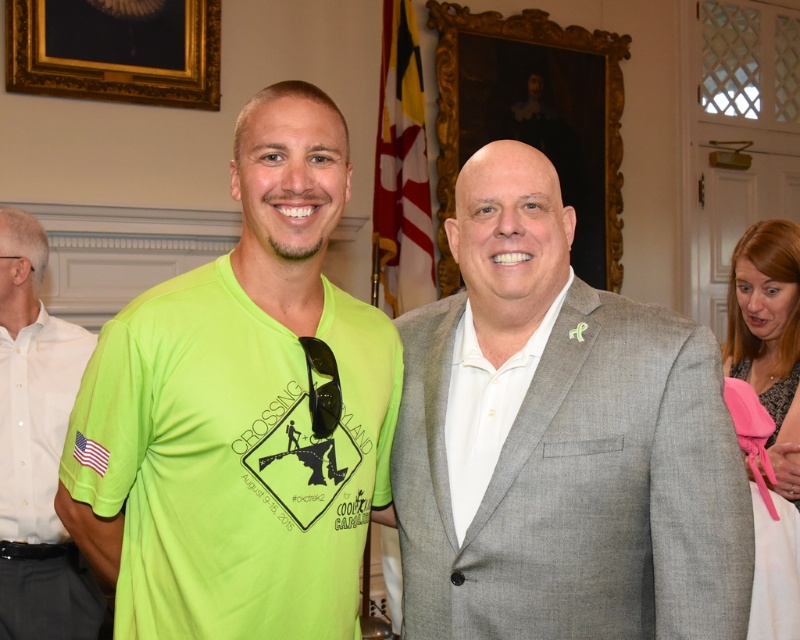
Question: Does neon green t-shirt at center have a smaller size compared to white smooth shirt at center?

Choices:
 (A) yes
 (B) no

Answer: (B)

Question: Which object appears closest to the camera in this image?

Choices:
 (A) white smooth shirt at center
 (B) neon green fabric at left
 (C) neon green t-shirt at center

Answer: (C)

Question: Considering the real-world distances, which object is closest to the white smooth shirt at center?

Choices:
 (A) gray suit at center
 (B) neon green fabric at left

Answer: (A)

Question: Which of the following is the farthest from the observer?

Choices:
 (A) (130, 326)
 (B) (509, 385)
 (C) (49, 483)
 (D) (656, 394)

Answer: (C)

Question: Is neon green t-shirt at center thinner than white smooth shirt at center?

Choices:
 (A) yes
 (B) no

Answer: (B)

Question: Does gray suit at center appear under neon green t-shirt at center?

Choices:
 (A) yes
 (B) no

Answer: (A)